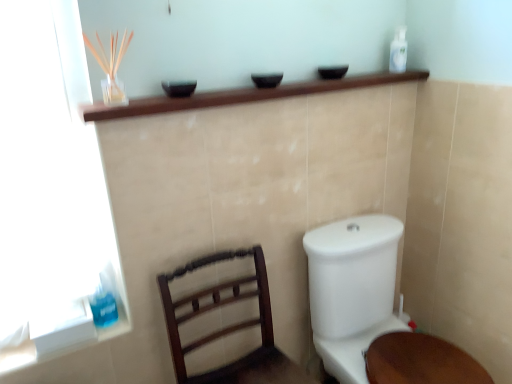
Question: From a real-world perspective, is blue translucent liquid at lower left, which appears as the 1th toiletry when viewed from the front, physically located above or below dark wood chair at lower left?

Choices:
 (A) above
 (B) below

Answer: (A)

Question: Is blue translucent liquid at lower left, the second toiletry viewed from the top, in front of or behind dark wood chair at lower left in the image?

Choices:
 (A) front
 (B) behind

Answer: (B)

Question: Estimate the real-world distances between objects in this image. Which object is farther from the blue translucent liquid at lower left, placed as the 1th toiletry when sorted from left to right?

Choices:
 (A) white plastic bottle at upper right, the 2th toiletry in the front-to-back sequence
 (B) white glossy toilet at lower right
 (C) dark wood chair at lower left

Answer: (A)

Question: Which of these objects is positioned farthest from the white glossy toilet at lower right?

Choices:
 (A) blue translucent liquid at lower left, placed as the 1th toiletry when sorted from left to right
 (B) white plastic bottle at upper right, the second toiletry from the left
 (C) dark wood chair at lower left

Answer: (B)